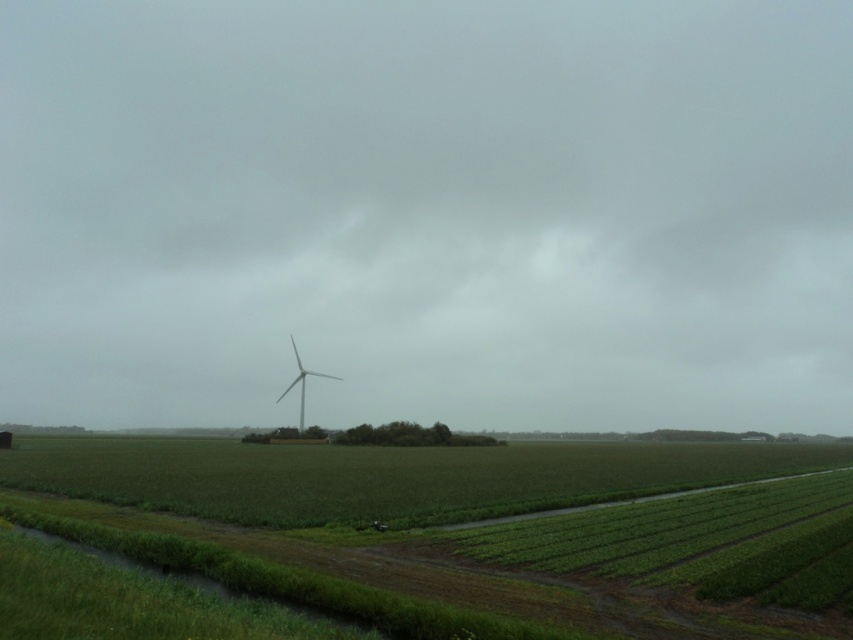
Question: Is matte white wind turbine at center to the right of green grassy field at center from the viewer's perspective?

Choices:
 (A) no
 (B) yes

Answer: (B)

Question: Which point is farther from the camera taking this photo?

Choices:
 (A) (474, 326)
 (B) (402, 486)

Answer: (A)

Question: Which object is the farthest from the matte white wind turbine at center?

Choices:
 (A) white matte windmill at center
 (B) green grassy field at center

Answer: (B)

Question: Which point appears farthest from the camera in this image?

Choices:
 (A) (212, 257)
 (B) (302, 404)

Answer: (A)

Question: Does green grassy field at center lie in front of white matte windmill at center?

Choices:
 (A) no
 (B) yes

Answer: (B)

Question: Where is green grassy field at center located in relation to white matte windmill at center in the image?

Choices:
 (A) left
 (B) right

Answer: (B)